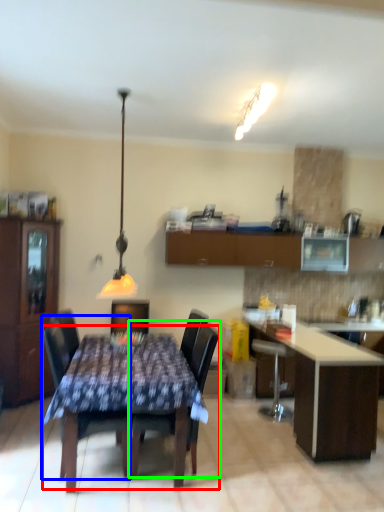
Question: Estimate the real-world distances between objects in this image. Which object is farther from kitchen & dining room table (highlighted by a red box), chair (highlighted by a blue box) or chair (highlighted by a green box)?

Choices:
 (A) chair
 (B) chair

Answer: (A)